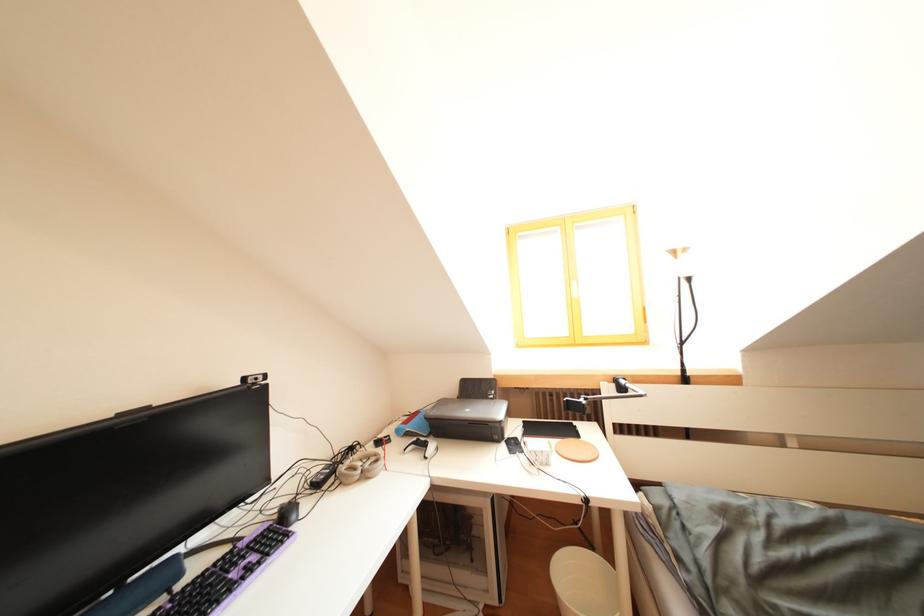
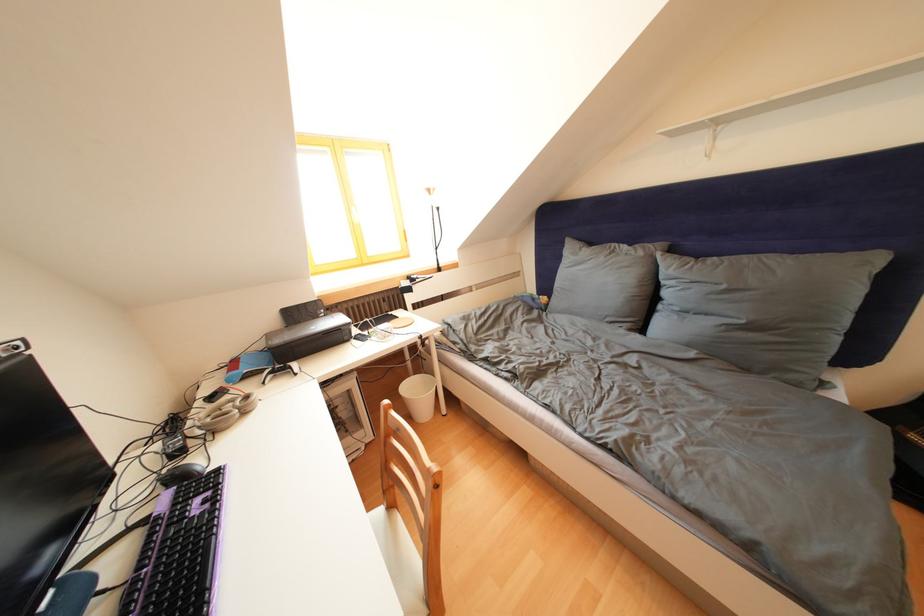
The point at [386,447] is marked in the first image. Where is the corresponding point in the second image?

(220, 403)